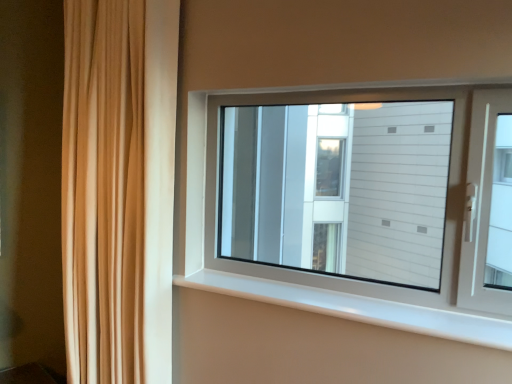
Question: Considering the relative positions of white plastic window sill at center and beige fabric curtain at left in the image provided, is white plastic window sill at center in front of beige fabric curtain at left?

Choices:
 (A) yes
 (B) no

Answer: (A)

Question: From the image's perspective, is white plastic window sill at center below beige fabric curtain at left?

Choices:
 (A) no
 (B) yes

Answer: (B)

Question: Does white plastic window sill at center have a greater height compared to beige fabric curtain at left?

Choices:
 (A) yes
 (B) no

Answer: (B)

Question: Can you see white plastic window sill at center touching beige fabric curtain at left?

Choices:
 (A) yes
 (B) no

Answer: (B)

Question: Is white plastic window sill at center further to camera compared to beige fabric curtain at left?

Choices:
 (A) no
 (B) yes

Answer: (A)

Question: Is white plastic window sill at center bigger than beige fabric curtain at left?

Choices:
 (A) no
 (B) yes

Answer: (A)

Question: Does beige fabric curtain at left appear on the left side of white plastic window sill at center?

Choices:
 (A) yes
 (B) no

Answer: (A)

Question: Is the surface of beige fabric curtain at left in direct contact with white plastic window sill at center?

Choices:
 (A) yes
 (B) no

Answer: (B)

Question: From a real-world perspective, does beige fabric curtain at left sit lower than white plastic window sill at center?

Choices:
 (A) yes
 (B) no

Answer: (B)

Question: Could you tell me if beige fabric curtain at left is turned towards white plastic window sill at center?

Choices:
 (A) yes
 (B) no

Answer: (B)

Question: Is beige fabric curtain at left not inside white plastic window sill at center?

Choices:
 (A) no
 (B) yes

Answer: (B)

Question: From the image's perspective, is beige fabric curtain at left above white plastic window sill at center?

Choices:
 (A) yes
 (B) no

Answer: (A)

Question: From the image's perspective, is beige fabric curtain at left above or below white plastic window sill at center?

Choices:
 (A) below
 (B) above

Answer: (B)